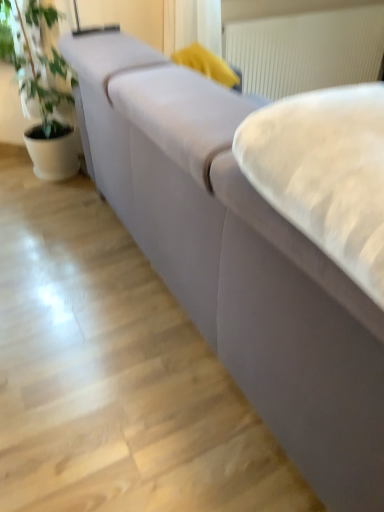
Question: In terms of height, does white textured radiator at upper center look taller or shorter compared to white soft cushion at center?

Choices:
 (A) tall
 (B) short

Answer: (A)

Question: From a real-world perspective, is white textured radiator at upper center physically located above or below white soft cushion at center?

Choices:
 (A) above
 (B) below

Answer: (B)

Question: Is white textured radiator at upper center wider or thinner than white soft cushion at center?

Choices:
 (A) wide
 (B) thin

Answer: (B)

Question: Is white soft cushion at center wider or thinner than white textured radiator at upper center?

Choices:
 (A) wide
 (B) thin

Answer: (A)

Question: From the image's perspective, is white soft cushion at center above or below white textured radiator at upper center?

Choices:
 (A) above
 (B) below

Answer: (B)

Question: Is white soft cushion at center to the left or to the right of white textured radiator at upper center in the image?

Choices:
 (A) left
 (B) right

Answer: (A)

Question: Is point (362, 146) positioned closer to the camera than point (311, 27)?

Choices:
 (A) closer
 (B) farther

Answer: (A)